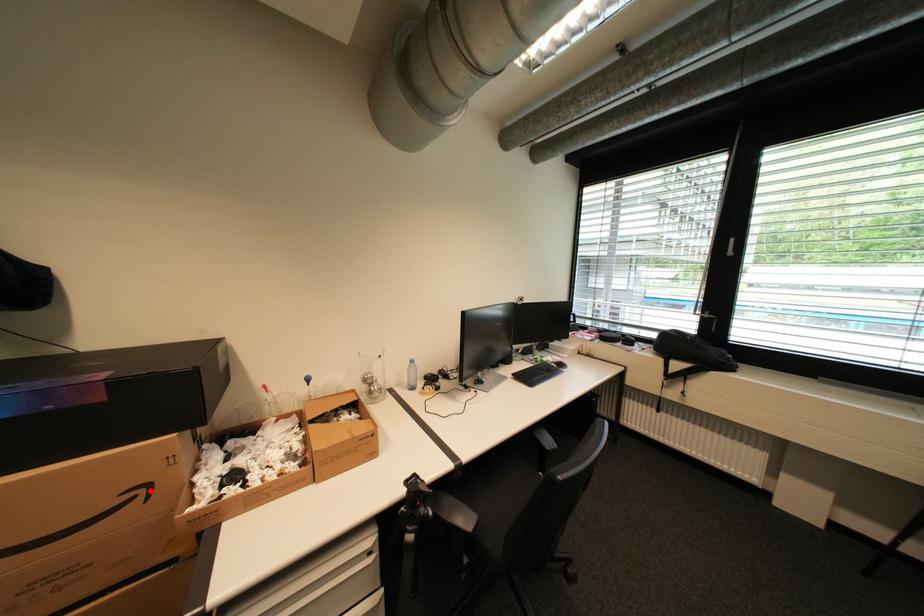
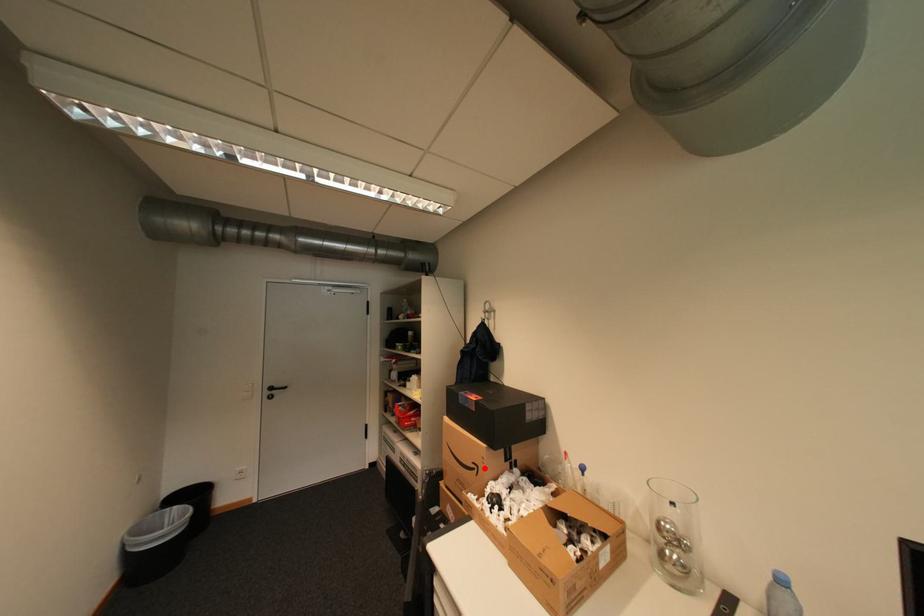
I am providing you with two images of the same scene from different viewpoints. A red point is marked on the first image and another point is marked on the second image. Does the point marked in image1 correspond to the same location as the one in image2?

Yes